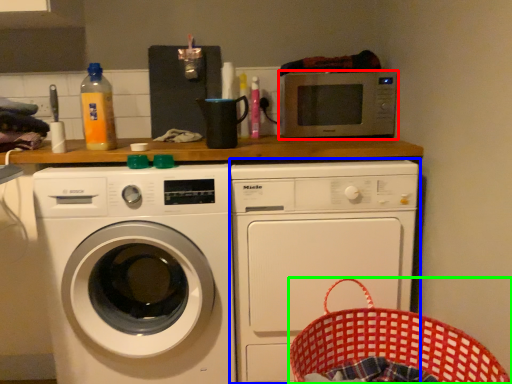
Question: Based on their relative distances, which object is nearer to microwave oven (highlighted by a red box)? Choose from washing machine (highlighted by a blue box) and basket (highlighted by a green box).

Choices:
 (A) washing machine
 (B) basket

Answer: (A)